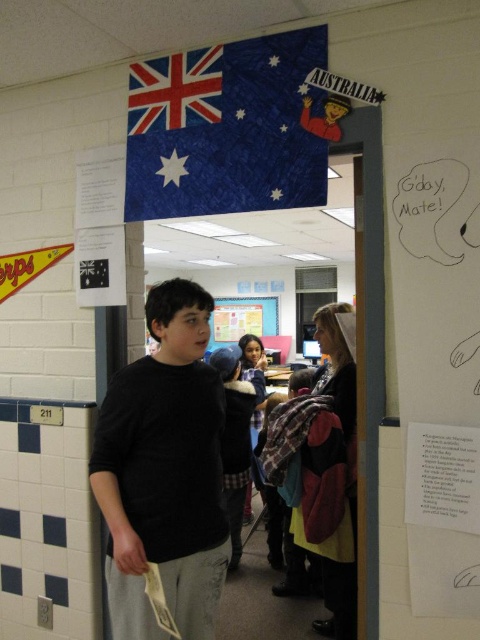
Question: Which object appears closest to the camera in this image?

Choices:
 (A) black matte shirt at center
 (B) blue fabric flag at upper center
 (C) white paper at upper right

Answer: (A)

Question: Is black matte shirt at center below blue fabric flag at upper center?

Choices:
 (A) no
 (B) yes

Answer: (B)

Question: Does black matte shirt at center lie in front of plaid fabric shirt at center?

Choices:
 (A) yes
 (B) no

Answer: (A)

Question: Estimate the real-world distances between objects in this image. Which object is farther from the white paper at upper right?

Choices:
 (A) blue fabric flag at upper center
 (B) plaid fabric shirt at center
 (C) black matte shirt at center

Answer: (B)

Question: Which point is farther from the camera taking this photo?

Choices:
 (A) (232, 516)
 (B) (467, 529)
 (C) (123, 568)

Answer: (A)

Question: Does blue fabric flag at upper center have a larger size compared to plaid fabric shirt at center?

Choices:
 (A) yes
 (B) no

Answer: (B)